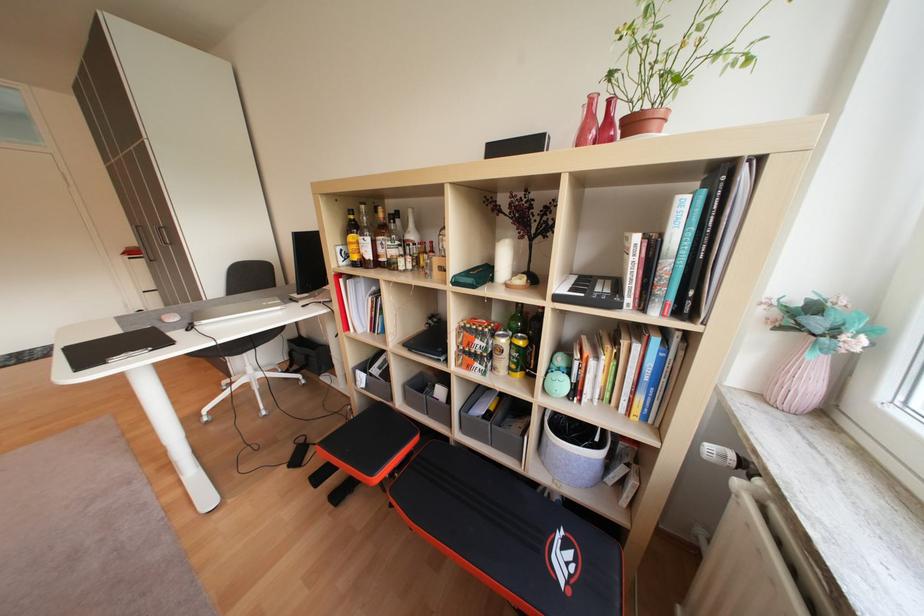
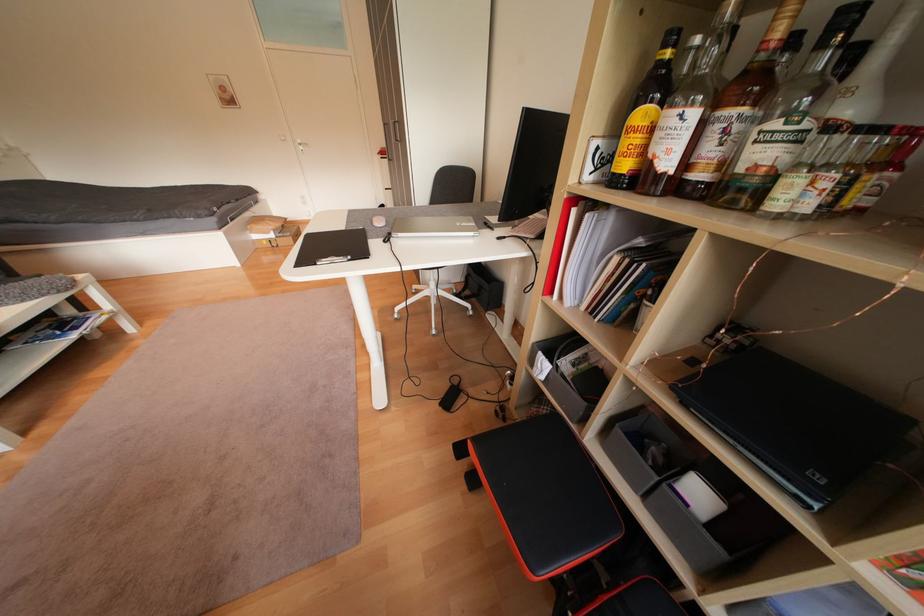
Based on the continuous images, in which direction is the camera rotating?

The camera's rotation is toward left-down.